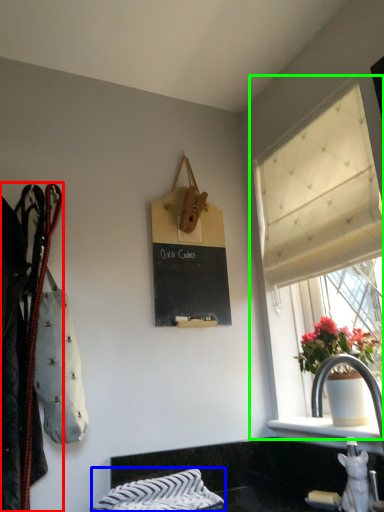
Question: Based on their relative distances, which object is farther from closet (highlighted by a red box)? Choose from blanket (highlighted by a blue box) and window (highlighted by a green box).

Choices:
 (A) blanket
 (B) window

Answer: (B)